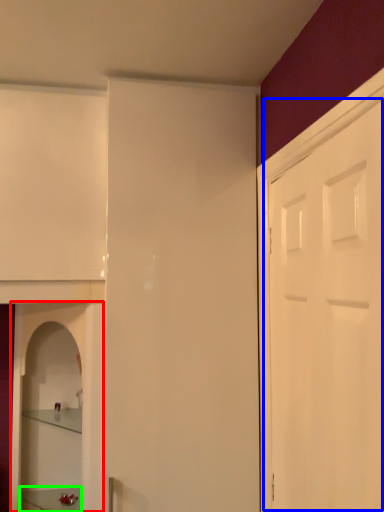
Question: Estimate the real-world distances between objects in this image. Which object is farther from cabinetry (highlighted by a red box), door (highlighted by a blue box) or furniture (highlighted by a green box)?

Choices:
 (A) door
 (B) furniture

Answer: (A)